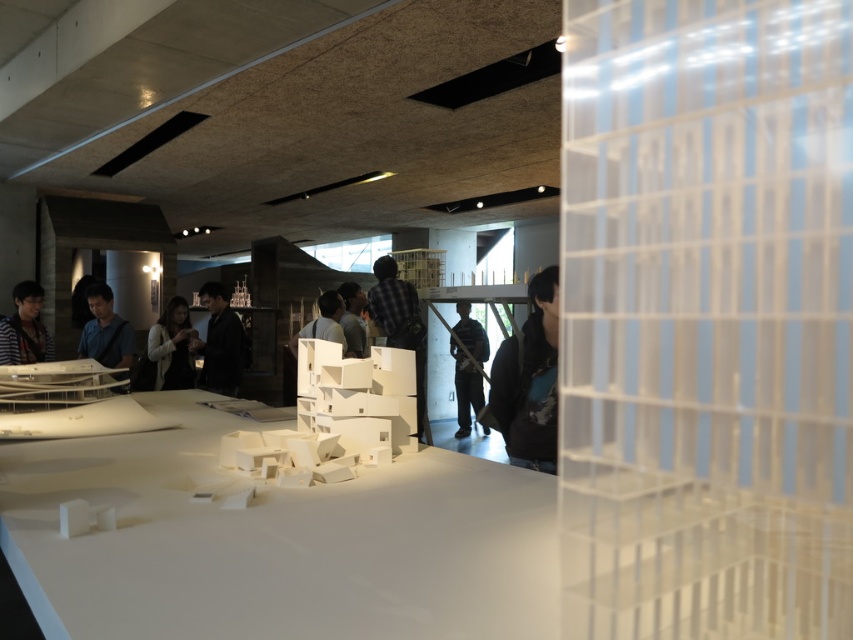
You are an attendee at the exhibition and want to get a better view of the architectural models on the table. You are currently standing behind the striped shirt at left and the black matte jacket at center. Which person should you move around to see the models clearly?

A: You should move around the black matte jacket at center because the striped shirt at left is behind it, so moving around the black matte jacket at center would provide a clearer view of the models.

You are an event organizer at the exhibition and need to arrange a photo shoot. You want to ensure that the black matte jacket at center and the striped shirt at left are visible in the photo. Based on their positions, which one should be placed to the right side in the photo composition?

The black matte jacket at center is already positioned on the right side of the striped shirt at left, so in the photo composition, the black matte jacket at center should be placed to the right side.

You are an event planner observing the indoor exhibition space. You need to arrange a microphone stand between the matte blue shirt at center and the dark gray shirt at center so that it is equidistant from both. Considering their heights, which shirt should the stand be closer to?

The matte blue shirt at center is taller than the dark gray shirt at center. To position the microphone stand equidistant from both, it should be placed closer to the dark gray shirt at center since the taller matte blue shirt at center would require more space to maintain equal distance.